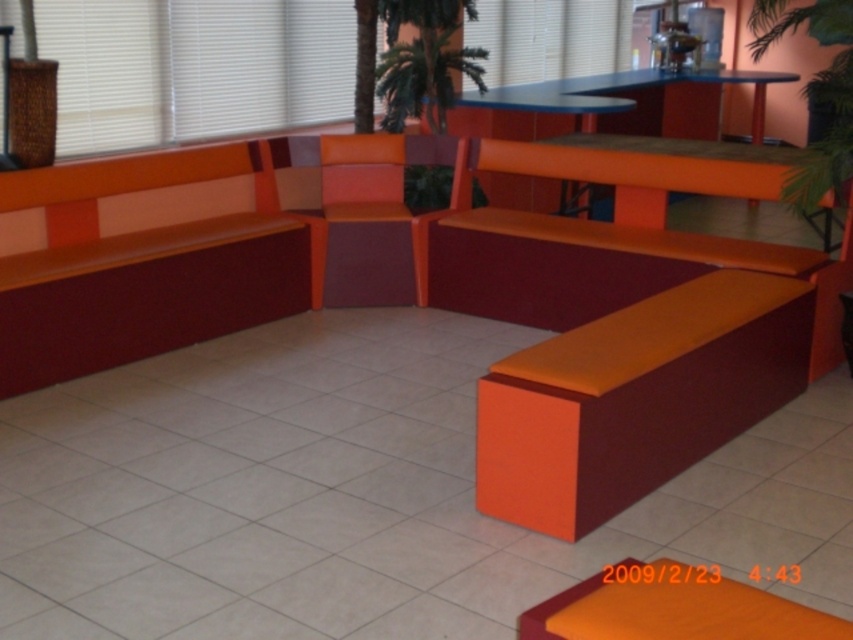
Does orange matte bench at left have a smaller size compared to green leafy palm tree at upper center?

Incorrect, orange matte bench at left is not smaller in size than green leafy palm tree at upper center.

Which is below, orange matte bench at left or green leafy palm tree at upper center?

Positioned lower is orange matte bench at left.

Between point (102, 342) and point (389, 112), which one is positioned in front?

Point (102, 342) is in front.

At what (x,y) coordinates should I click in order to perform the action: click on orange matte bench at left. Please return your answer as a coordinate pair (x, y). This screenshot has height=640, width=853. Looking at the image, I should click on (141, 268).

Is point (717, 109) closer to viewer compared to point (450, 52)?

No, it is behind (450, 52).

Who is positioned more to the left, orange matte table at upper center or green leafy palm tree at upper center?

green leafy palm tree at upper center is more to the left.

Who is more forward, (776, 83) or (432, 81)?

Point (432, 81) is in front.

You are a GUI agent. You are given a task and a screenshot of the screen. Output one action in this format:
    pyautogui.click(x=<x>, y=<y>)
    Task: Click on the orange matte table at upper center
    The width and height of the screenshot is (853, 640).
    Given the screenshot: What is the action you would take?
    pyautogui.click(x=613, y=106)

Which is in front, point (525, 99) or point (350, 228)?

Point (350, 228) is more forward.

From the picture: Who is lower down, orange matte table at upper center or matte orange chair at center?

matte orange chair at center is lower down.

Which is in front, point (654, 109) or point (341, 244)?

Positioned in front is point (341, 244).

Find the location of a particular element. The height and width of the screenshot is (640, 853). orange matte table at upper center is located at coordinates (613, 106).